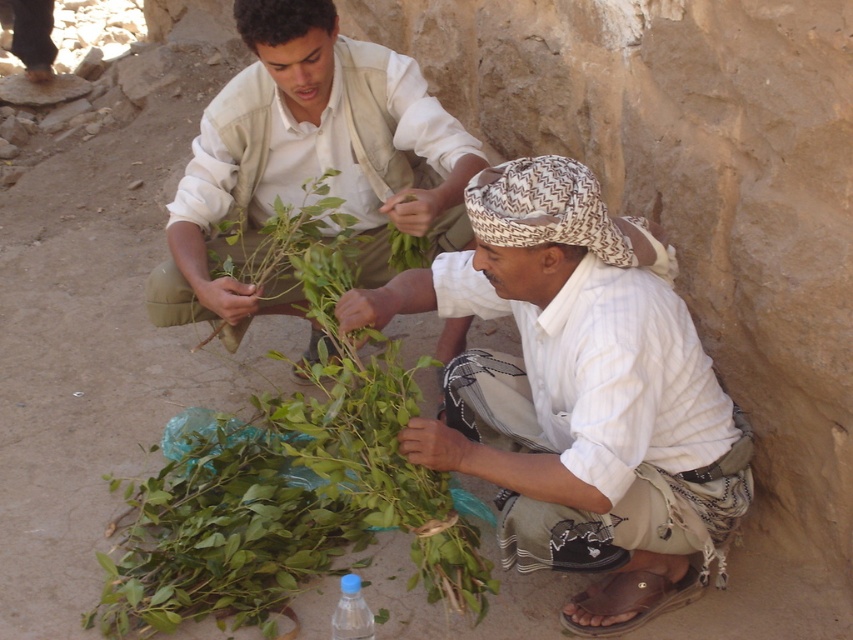
From the picture: Who is taller, green leafy plant at center or brown leather sandal at lower right?

green leafy plant at center is taller.

Does green leafy plant at center appear on the left side of brown leather sandal at lower right?

Yes, green leafy plant at center is to the left of brown leather sandal at lower right.

The height and width of the screenshot is (640, 853). What are the coordinates of `green leafy plant at center` in the screenshot? It's located at (289, 477).

In the scene shown: Can you confirm if white striped fabric at center is positioned to the left of brown leather sandal at lower right?

Indeed, white striped fabric at center is positioned on the left side of brown leather sandal at lower right.

Consider the image. Does white striped fabric at center come behind brown leather sandal at lower right?

That is False.

Locate an element on the screen. Image resolution: width=853 pixels, height=640 pixels. white striped fabric at center is located at coordinates (578, 396).

Is white striped fabric at center thinner than green leafy plant at center?

Yes.

Which is more to the right, white striped fabric at center or green leafy plant at center?

From the viewer's perspective, white striped fabric at center appears more on the right side.

Where is `white striped fabric at center`? Image resolution: width=853 pixels, height=640 pixels. white striped fabric at center is located at coordinates (578, 396).

You are a GUI agent. You are given a task and a screenshot of the screen. Output one action in this format:
    pyautogui.click(x=<x>, y=<y>)
    Task: Click on the white striped fabric at center
    
    Given the screenshot: What is the action you would take?
    pyautogui.click(x=578, y=396)